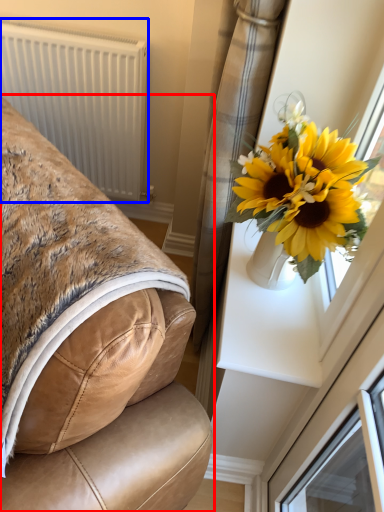
Question: Which object is closer to the camera taking this photo, furniture (highlighted by a red box) or radiator (highlighted by a blue box)?

Choices:
 (A) furniture
 (B) radiator

Answer: (A)